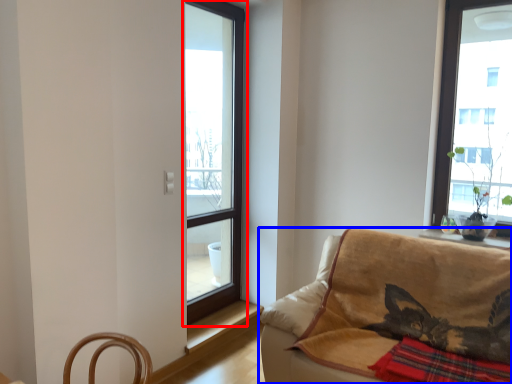
Question: Which object is closer to the camera taking this photo, window (highlighted by a red box) or studio couch (highlighted by a blue box)?

Choices:
 (A) window
 (B) studio couch

Answer: (B)